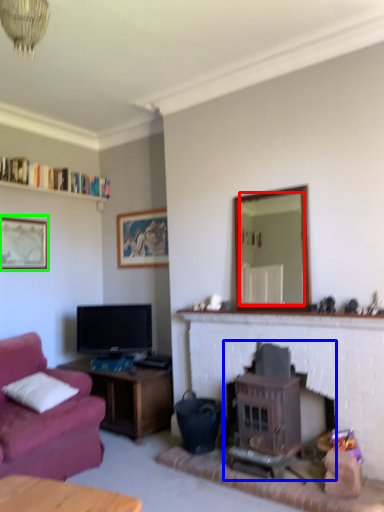
Question: Considering the real-world distances, which object is farthest from mirror (highlighted by a red box)? wood burning stove (highlighted by a blue box) or picture frame (highlighted by a green box)?

Choices:
 (A) wood burning stove
 (B) picture frame

Answer: (A)